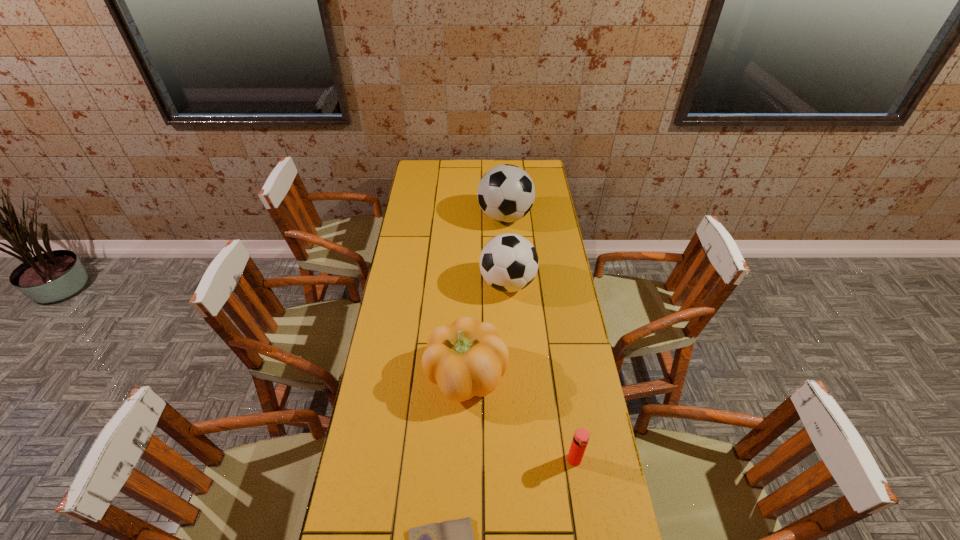
Locate an element on the screen. thermos bottle that is at the right edge is located at coordinates 581,436.

Where is `vacant space at the far edge of the desktop`? This screenshot has width=960, height=540. vacant space at the far edge of the desktop is located at coordinates (467, 175).

Where is `vacant space at the left edge`? The height and width of the screenshot is (540, 960). vacant space at the left edge is located at coordinates (424, 284).

Find the location of a particular element. This screenshot has height=540, width=960. free space at the right edge of the desktop is located at coordinates (559, 421).

You are a GUI agent. You are given a task and a screenshot of the screen. Output one action in this format:
    pyautogui.click(x=<x>, y=<y>)
    Task: Click on the vacant space at the far left corner of the desktop
    
    Given the screenshot: What is the action you would take?
    pyautogui.click(x=422, y=165)

This screenshot has width=960, height=540. I want to click on vacant space at the far right corner, so click(530, 162).

Image resolution: width=960 pixels, height=540 pixels. Identify the location of vacant space that is in between the nearer soccer ball and the thermos bottle. (541, 372).

At what (x,y) coordinates should I click in order to perform the action: click on vacant area that lies between the third nearest object and the thermos bottle. Please return your answer as a coordinate pair (x, y). The image size is (960, 540). Looking at the image, I should click on (520, 418).

Locate which object ranks in proximity to the fourth tallest object. Please provide its 2D coordinates. Your answer should be formatted as a tuple, i.e. [(x, y)], where the tuple contains the x and y coordinates of a point satisfying the conditions above.

[(467, 358)]

Where is `object that can be found as the third closest to the farther soccer ball`? object that can be found as the third closest to the farther soccer ball is located at coordinates (581, 436).